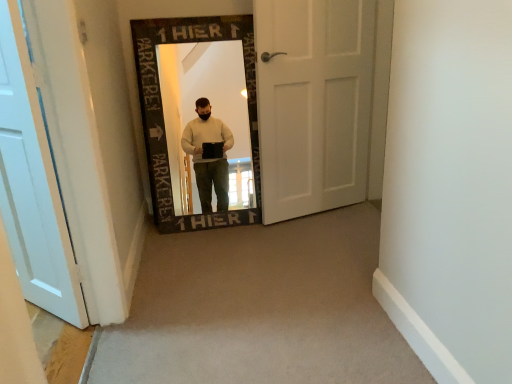
Question: Does white matte door at center, positioned as the second door in left-to-right order, come in front of white painted wood door at left, which is the first door from left to right?

Choices:
 (A) yes
 (B) no

Answer: (B)

Question: Is white matte door at center, the 1th door in the back-to-front sequence, shorter than white painted wood door at left, which is counted as the first door, starting from the front?

Choices:
 (A) no
 (B) yes

Answer: (A)

Question: Is white matte door at center, which is the 2th door from front to back, placed right next to white painted wood door at left, which is the first door from left to right?

Choices:
 (A) no
 (B) yes

Answer: (A)

Question: Does white matte door at center, the 1th door positioned from the right, have a lesser width compared to white painted wood door at left, which is the second door from right to left?

Choices:
 (A) yes
 (B) no

Answer: (A)

Question: Is white matte door at center, which is the 2th door from front to back, located outside white painted wood door at left, which is the first door from left to right?

Choices:
 (A) yes
 (B) no

Answer: (A)

Question: Considering the relative sizes of white matte door at center, the 1th door in the back-to-front sequence, and white painted wood door at left, which is the first door from left to right, in the image provided, is white matte door at center, the 1th door in the back-to-front sequence, wider than white painted wood door at left, which is the first door from left to right,?

Choices:
 (A) yes
 (B) no

Answer: (B)

Question: Is white painted wood door at left, placed as the second door when sorted from back to front, shorter than white matte door at center, which is the 2th door from front to back?

Choices:
 (A) no
 (B) yes

Answer: (B)

Question: Is white painted wood door at left, placed as the second door when sorted from back to front, outside of white matte door at center, positioned as the second door in left-to-right order?

Choices:
 (A) yes
 (B) no

Answer: (A)

Question: From the image's perspective, is white painted wood door at left, placed as the second door when sorted from back to front, on top of white matte door at center, the 1th door positioned from the right?

Choices:
 (A) no
 (B) yes

Answer: (A)

Question: Is white painted wood door at left, which is counted as the first door, starting from the front, closer to camera compared to white matte door at center, which is the 2th door from front to back?

Choices:
 (A) no
 (B) yes

Answer: (B)

Question: From a real-world perspective, is white painted wood door at left, placed as the second door when sorted from back to front, on white matte door at center, the 1th door in the back-to-front sequence?

Choices:
 (A) no
 (B) yes

Answer: (A)

Question: Would you consider white painted wood door at left, which is counted as the first door, starting from the front, to be distant from white matte door at center, which is the 2th door from front to back?

Choices:
 (A) yes
 (B) no

Answer: (A)

Question: From the image's perspective, is white painted wood door at left, which is counted as the first door, starting from the front, above or below white matte door at center, the 1th door positioned from the right?

Choices:
 (A) below
 (B) above

Answer: (A)